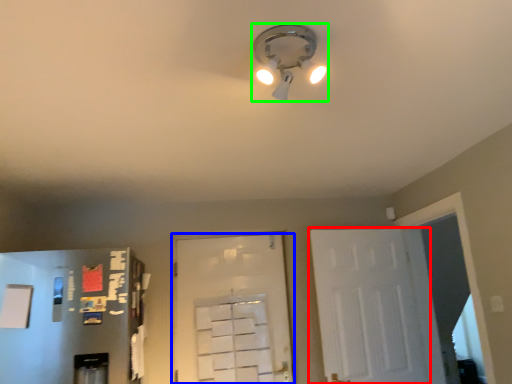
Question: Which object is positioned closest to door (highlighted by a red box)? Select from door (highlighted by a blue box) and lamp (highlighted by a green box).

Choices:
 (A) door
 (B) lamp

Answer: (A)